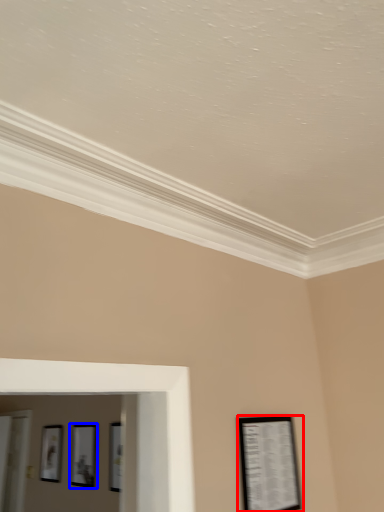
Question: Which of the following is the closest to the observer, picture frame (highlighted by a red box) or picture frame (highlighted by a blue box)?

Choices:
 (A) picture frame
 (B) picture frame

Answer: (A)